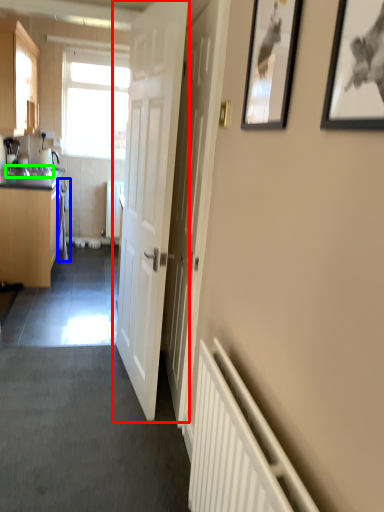
Question: Estimate the real-world distances between objects in this image. Which object is farther from door (highlighted by a red box), laundry (highlighted by a blue box) or sink (highlighted by a green box)?

Choices:
 (A) laundry
 (B) sink

Answer: (A)